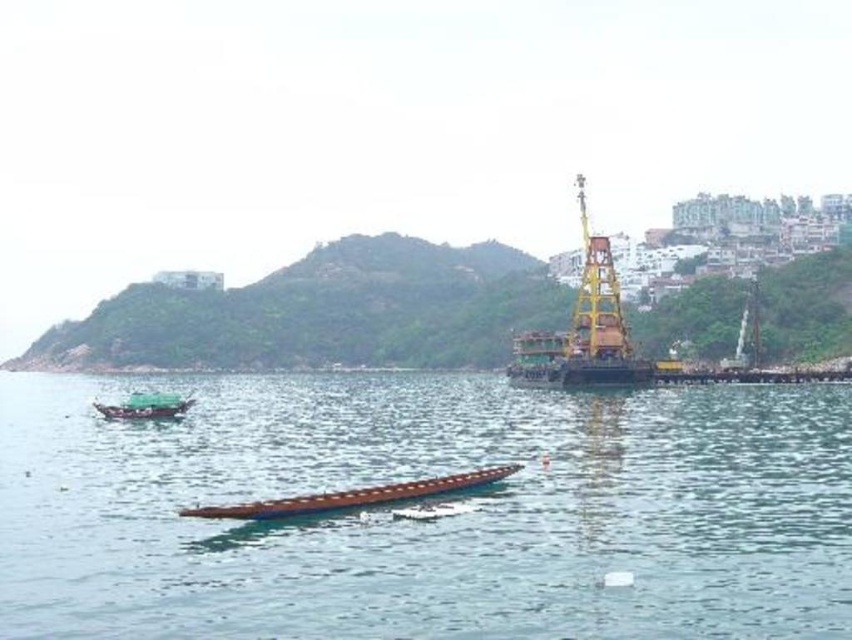
You are standing on the dock and see both the brown wooden plank at center and the brown wooden canoe at center. Which object is closer to you?

The brown wooden plank at center is closer to you because it is in front of the brown wooden canoe at center.

You are standing on the dock and need to transport a heavy crate from the brown wooden plank at center to the brown wooden canoe at center. The crate requires a minimum of 100 feet of space to be moved safely. Can you move it directly between these two points without needing to adjust the path?

The brown wooden plank at center is 120.84 feet away from the brown wooden canoe at center, which is more than the required 100 feet. Therefore, you can move the crate directly between these two points without needing to adjust the path.

You are standing on the brown wooden plank at center and want to see the green grassy hillside at upper center. Can you see the top of the green grassy hillside from your current position?

The brown wooden plank at center has a lesser height compared to green grassy hillside at upper center. Since the plank is shorter, you can see the top of the green grassy hillside at upper center from your position.